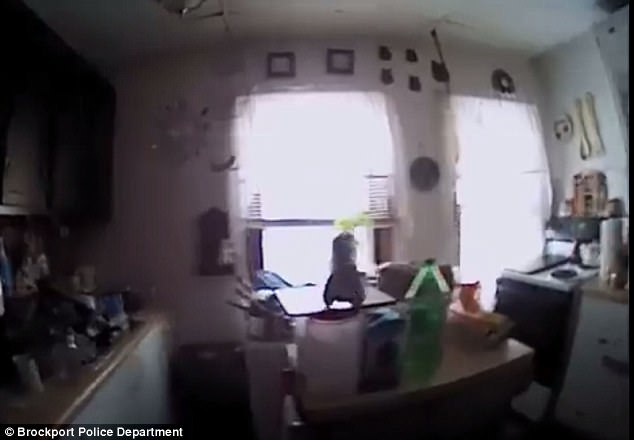
Locate an element on the screen. The height and width of the screenshot is (440, 634). napkin roll is located at coordinates (614, 239).